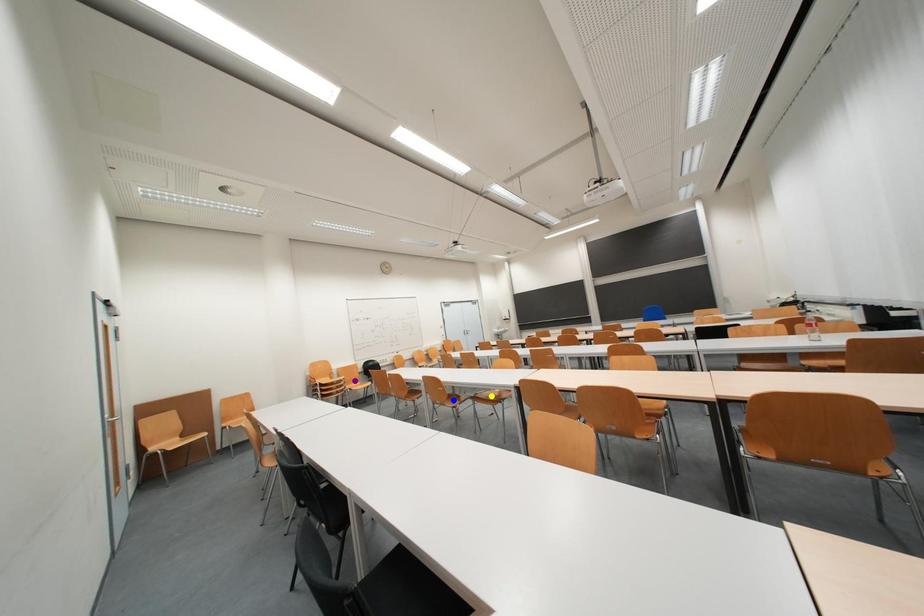
Consider the image. Order these from nearest to farthest:
yellow point | blue point | purple point

purple point, yellow point, blue point